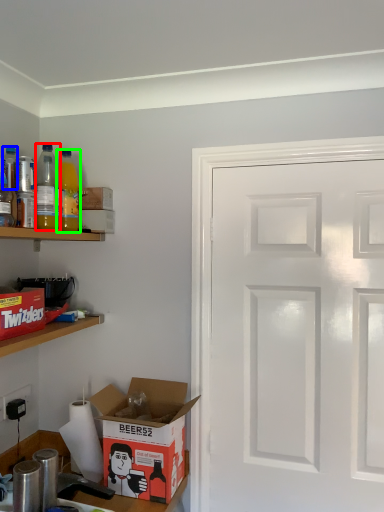
Question: Estimate the real-world distances between objects in this image. Which object is farther from bottle (highlighted by a red box), bottle (highlighted by a blue box) or bottle (highlighted by a green box)?

Choices:
 (A) bottle
 (B) bottle

Answer: (A)